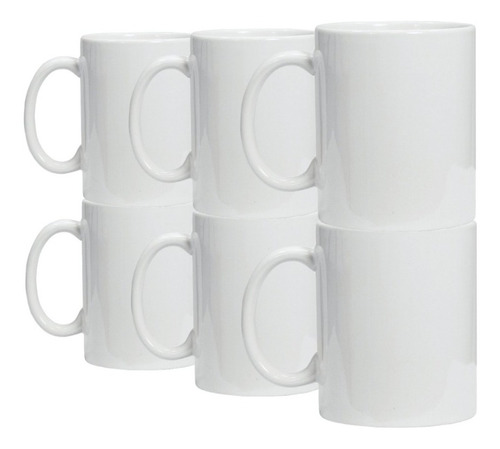
The image size is (500, 449). Find the location of `coffee mug`. coffee mug is located at coordinates (404, 318), (383, 132), (225, 65), (235, 251), (99, 228), (95, 140).